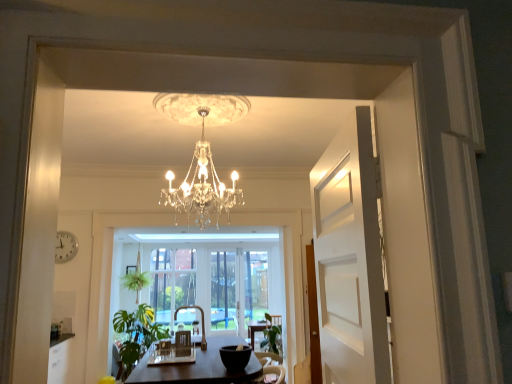
Question: Looking at the image, does wooden armchair at center, the first armchair when ordered from back to front, seem bigger or smaller compared to green leafy plant at center, the 1th plant from the back?

Choices:
 (A) small
 (B) big

Answer: (A)

Question: Is wooden armchair at center, the first armchair when ordered from back to front, wider or thinner than green leafy plant at center, the 1th plant from the back?

Choices:
 (A) wide
 (B) thin

Answer: (B)

Question: Which of these objects is positioned closest to the clear glass window screen at center, marked as the 2th window screen in a left-to-right arrangement?

Choices:
 (A) clear glass window screen at center, which appears as the second window screen when viewed from the right
 (B) green leafy plant at lower left
 (C) white plastic clock at left
 (D) green leafy plant at lower center, the 1th plant positioned from the right
 (E) brown leather armchair at center, the 2th armchair positioned from the back

Answer: (A)

Question: Which object is the closest to the wooden armchair at center, the third armchair positioned from the front?

Choices:
 (A) green leafy plant at center, placed as the second plant when sorted from right to left
 (B) clear glass window screen at center, marked as the 2th window screen in a left-to-right arrangement
 (C) green leafy plant at lower center, acting as the 2th plant starting from the left
 (D) green leafy plant at lower left
 (E) brown leather armchair at center, marked as the second armchair in a front-to-back arrangement

Answer: (E)